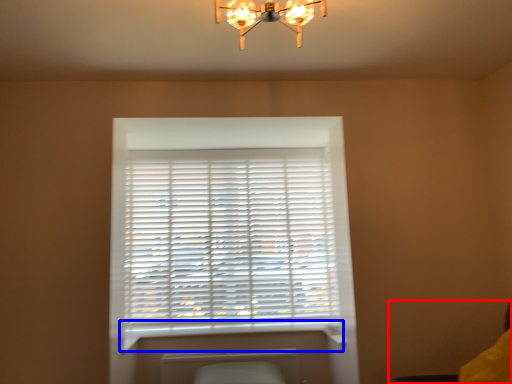
Question: Which point is closer to the camera, swivel chair (highlighted by a red box) or window sill (highlighted by a blue box)?

Choices:
 (A) swivel chair
 (B) window sill

Answer: (A)